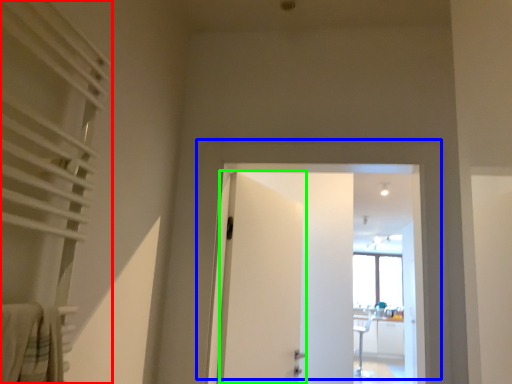
Question: Which object is positioned closest to curtain (highlighted by a red box)? Select from door (highlighted by a blue box) and door (highlighted by a green box).

Choices:
 (A) door
 (B) door

Answer: (A)